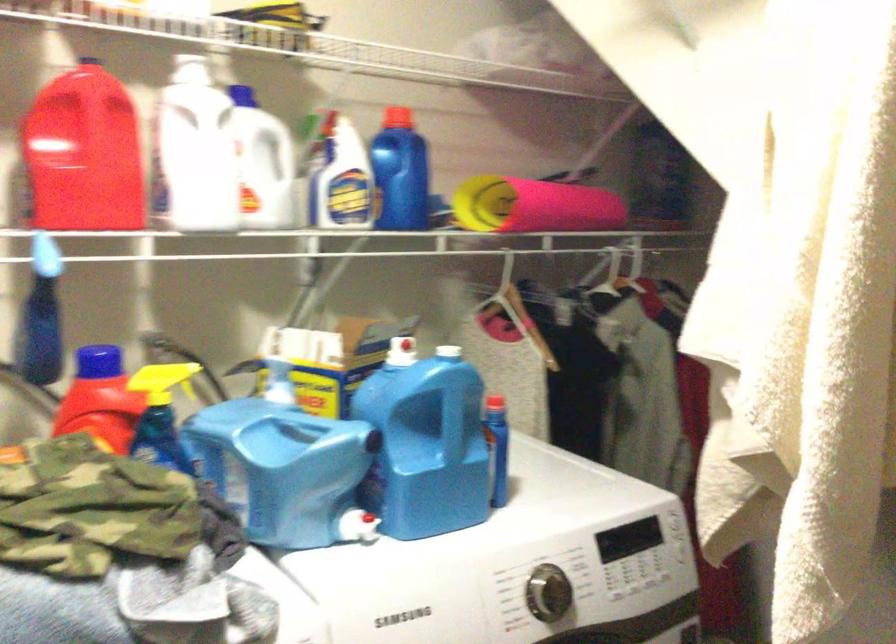
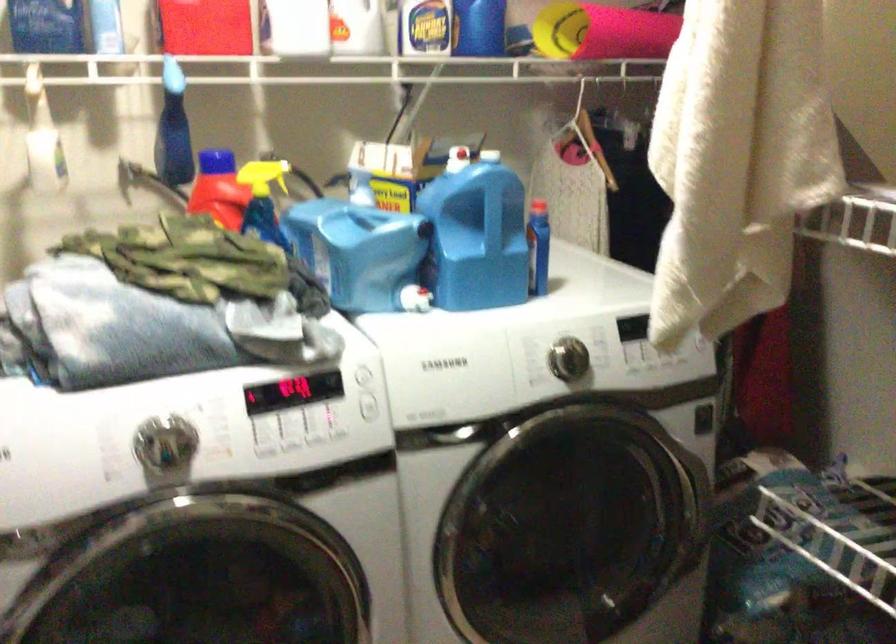
Where in the second image is the point corresponding to (x=495, y=451) from the first image?

(538, 247)